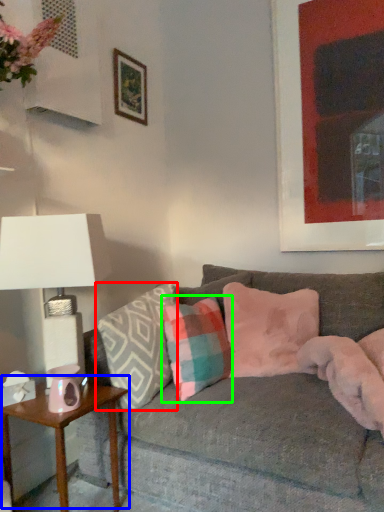
Question: Which object is positioned farthest from pillow (highlighted by a red box)? Select from table (highlighted by a blue box) and pillow (highlighted by a green box).

Choices:
 (A) table
 (B) pillow

Answer: (A)